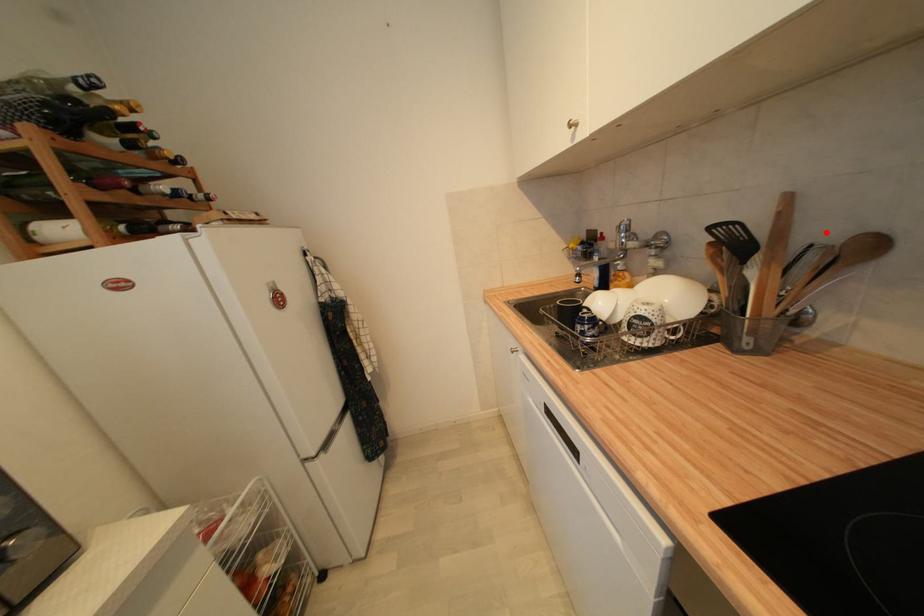
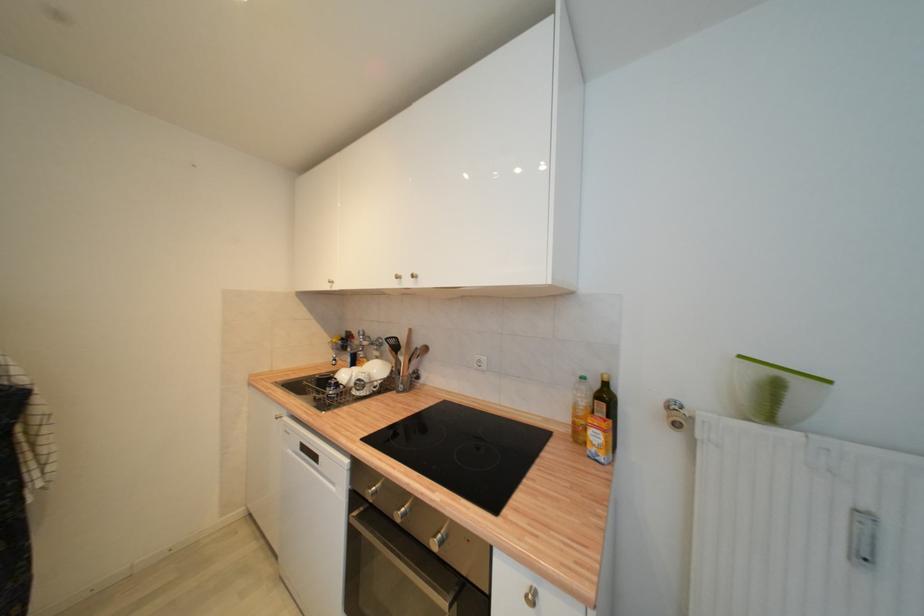
Find the pixel in the second image that matches the highlighted location in the first image.

(422, 345)